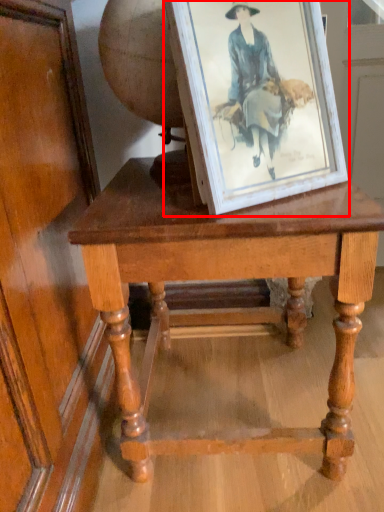
Question: From the image's perspective, considering the relative positions of picture frame (annotated by the red box) and table in the image provided, where is picture frame (annotated by the red box) located with respect to the staircase?

Choices:
 (A) below
 (B) above

Answer: (B)